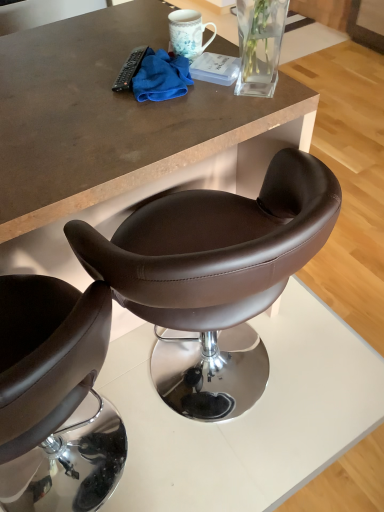
You are a GUI agent. You are given a task and a screenshot of the screen. Output one action in this format:
    pyautogui.click(x=<x>, y=<y>)
    Task: Click on the free spot above brown leather chair at center (from a real-world perspective)
    
    Given the screenshot: What is the action you would take?
    pyautogui.click(x=173, y=133)